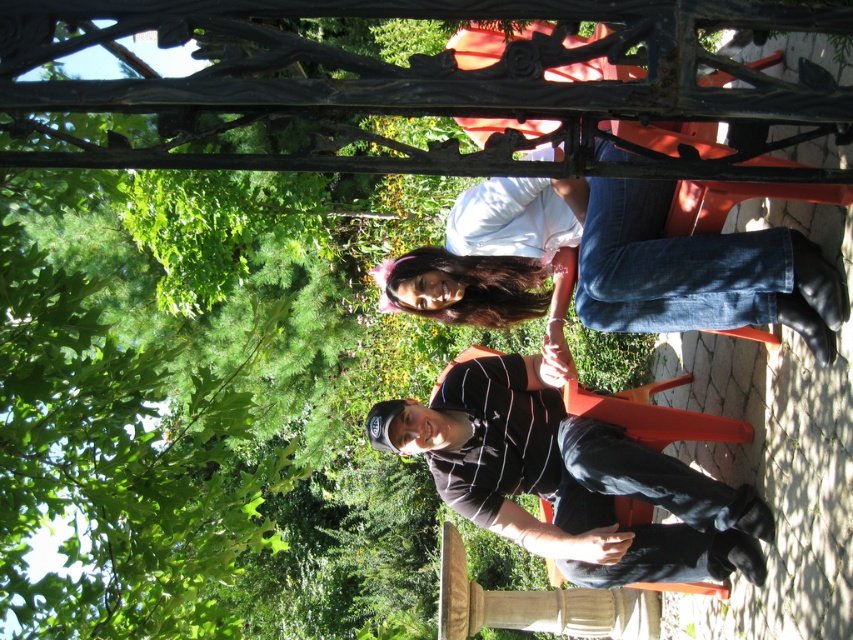
You are a photographer trying to capture a candid shot of the two people at the table. You notice the black striped shirt at center and denim jeans at center. Which clothing item is located to the right of the other?

The black striped shirt at center is positioned on the right side of denim jeans at center, so the black striped shirt at center is to the right of the denim jeans at center.

You are a photographer trying to capture a candid shot of the two people at the table. Since you want to focus on their faces, you need to ensure their clothing doesn not block the view. Based on the scene, will the black striped shirt at center cover any part of the denim jeans at center when taking the photo?

The black striped shirt at center is located below the denim jeans at center, so it will not cover any part of them in the photo.